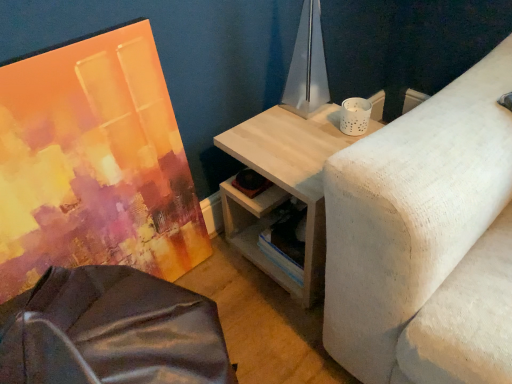
Question: Considering the positions of metallic silver table lamp at upper center and light wood/texture side table at upper right in the image, is metallic silver table lamp at upper center wider or thinner than light wood/texture side table at upper right?

Choices:
 (A) thin
 (B) wide

Answer: (A)

Question: Is metallic silver table lamp at upper center in front of or behind light wood/texture side table at upper right in the image?

Choices:
 (A) behind
 (B) front

Answer: (A)

Question: Considering the real-world distances, which object is closest to the metallic silver table lamp at upper center?

Choices:
 (A) matte acrylic painting at left
 (B) light wood/texture side table at upper right

Answer: (B)

Question: Estimate the real-world distances between objects in this image. Which object is closer to the light wood/texture side table at upper right?

Choices:
 (A) metallic silver table lamp at upper center
 (B) matte acrylic painting at left

Answer: (A)